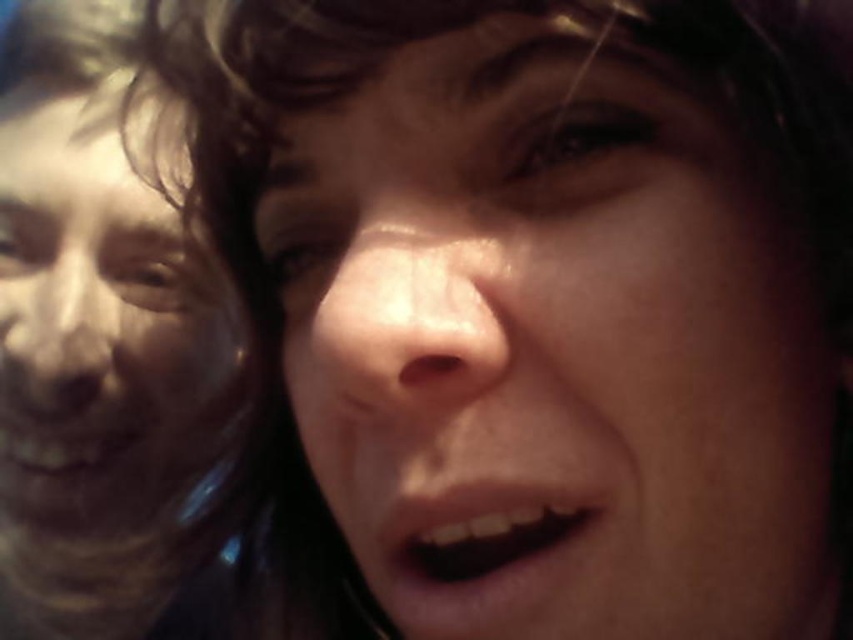
You are a photographer analyzing the composition of this image. The subject has a face centered at point [556,340]. Based on the scene description, where would you expect the other person in the background to be positioned relative to this point?

The smooth skin face at center is located at point [556,340]. The other person in the background is positioned outside the main focus area, likely to the side or behind the primary subject, as indicated by the blurred background and shallow depth of field.

You are a photographer trying to adjust the focus of your camera. You have two faces in the frame, the smooth skin face at center and the smooth skin face at left. Which face should you adjust the focus to if you want the closer face to be in sharp focus?

The smooth skin face at center is closer to the viewer than the smooth skin face at left, so you should adjust the focus to the smooth skin face at center to ensure it is in sharp focus.